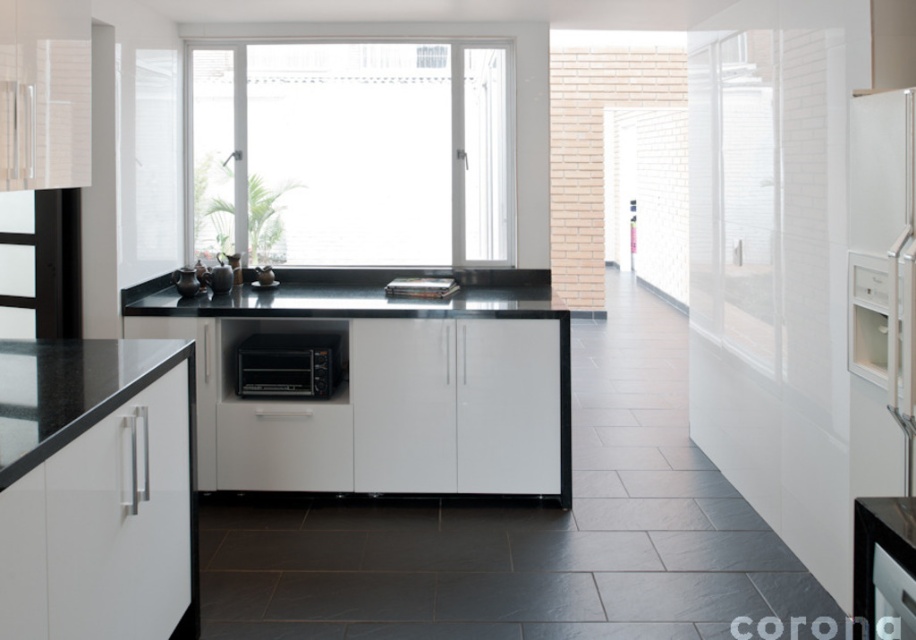
Can you confirm if transparent glass door at right is smaller than black granite countertop at center?

Indeed, transparent glass door at right has a smaller size compared to black granite countertop at center.

Does transparent glass door at right have a larger size compared to black granite countertop at center?

No.

Which is in front, point (734, 116) or point (514, 272)?

Point (734, 116) is in front.

Locate an element on the screen. This screenshot has width=916, height=640. transparent glass door at right is located at coordinates (735, 195).

Does white glass window at center have a larger size compared to black plastic toaster oven at center?

Yes.

Who is more distant from viewer, [267,225] or [308,355]?

Point [267,225]

Locate an element on the screen. The image size is (916, 640). white glass window at center is located at coordinates (354, 152).

Which is more to the left, black granite countertop at center or black granite countertop at lower left?

From the viewer's perspective, black granite countertop at lower left appears more on the left side.

Does black granite countertop at center have a greater height compared to black granite countertop at lower left?

Indeed, black granite countertop at center has a greater height compared to black granite countertop at lower left.

This screenshot has height=640, width=916. What do you see at coordinates (355, 296) in the screenshot? I see `black granite countertop at center` at bounding box center [355, 296].

Identify the location of black granite countertop at center. (355, 296).